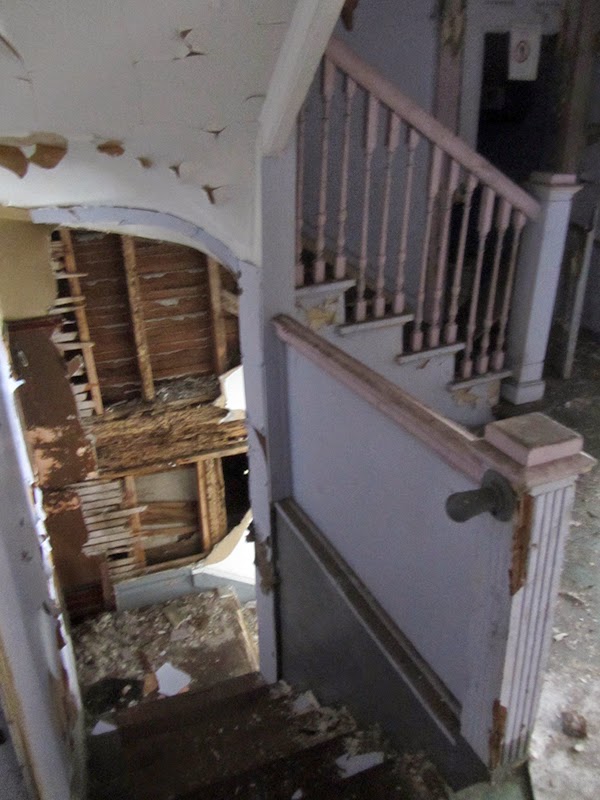
At what (x,y) coordinates should I click in order to perform the action: click on carpet. Please return your answer as a coordinate pair (x, y). This screenshot has height=800, width=600. Looking at the image, I should click on coord(231,656).